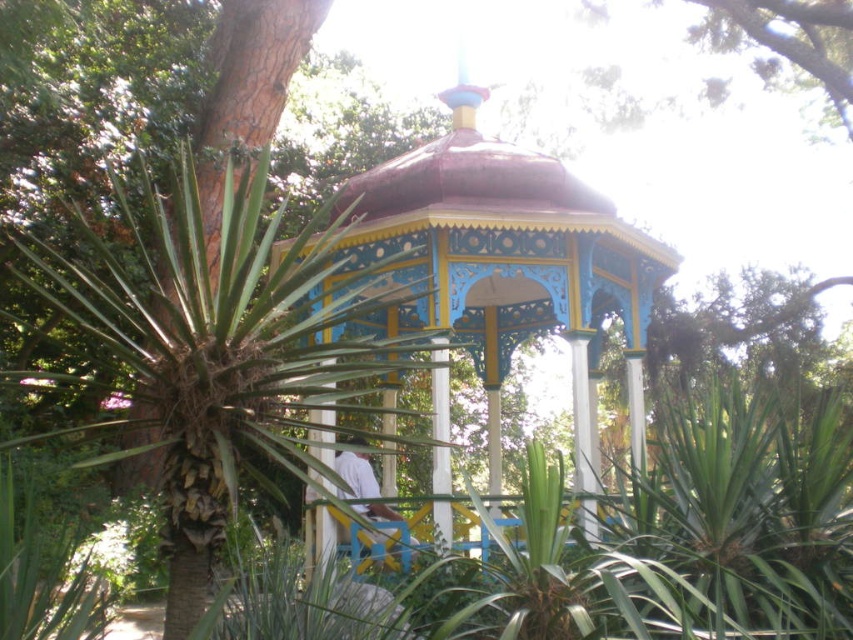
Question: Does green leafy palm tree at center appear on the right side of painted wood gazebo at center?

Choices:
 (A) no
 (B) yes

Answer: (A)

Question: Does green leafy palm tree at center have a greater width compared to painted wood gazebo at center?

Choices:
 (A) yes
 (B) no

Answer: (B)

Question: Which point is farther to the camera?

Choices:
 (A) (146, 403)
 (B) (469, 294)

Answer: (B)

Question: Is green leafy palm tree at center to the right of painted wood gazebo at center from the viewer's perspective?

Choices:
 (A) yes
 (B) no

Answer: (B)

Question: Which point is closer to the camera?

Choices:
 (A) painted wood gazebo at center
 (B) green leafy palm tree at center

Answer: (A)